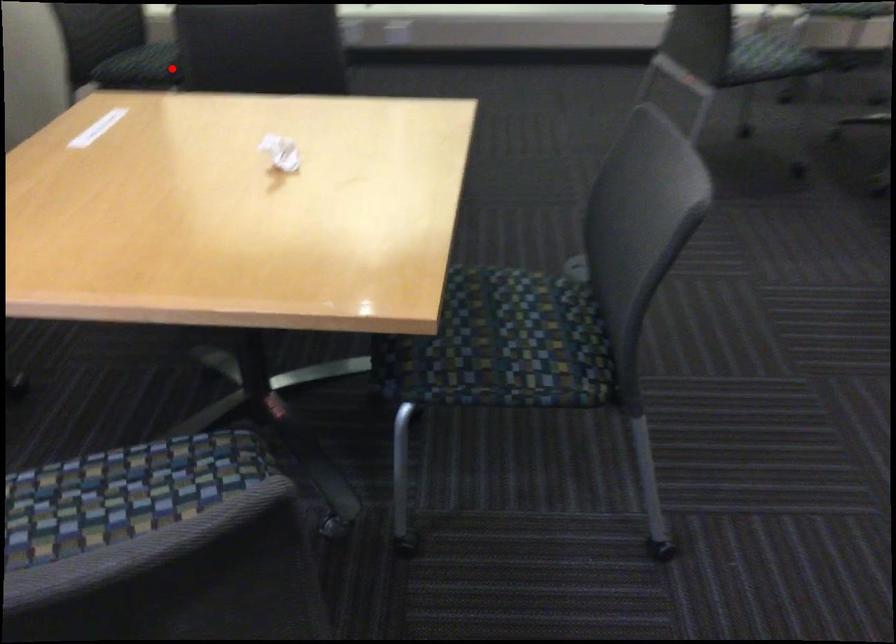
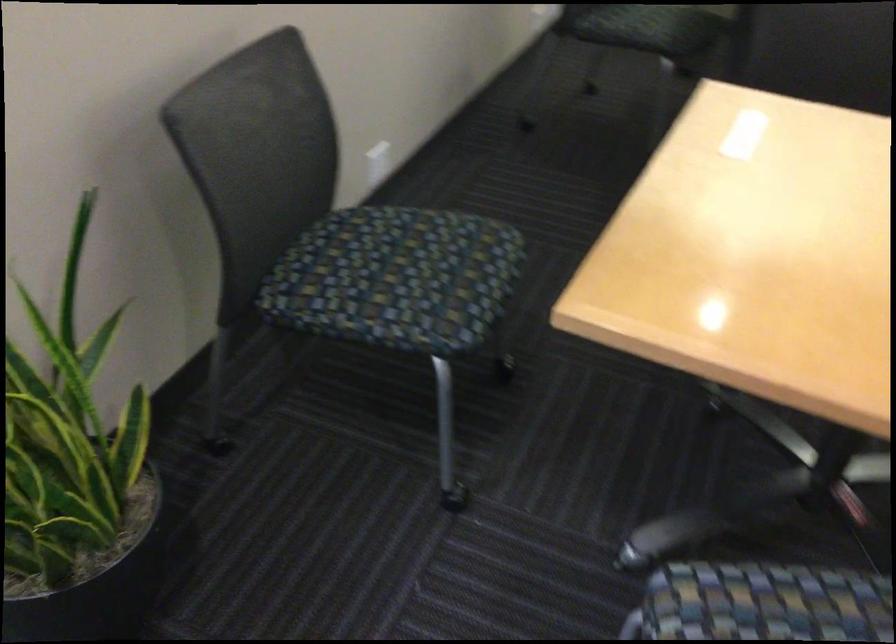
Where in the second image is the point corresponding to the highlighted location from the first image?

(649, 28)